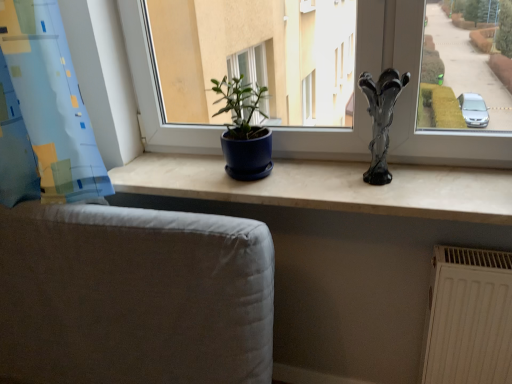
Question: Is point (382, 130) positioned closer to the camera than point (42, 89)?

Choices:
 (A) farther
 (B) closer

Answer: (A)

Question: Is transparent glass vase at right wider or thinner than blue fabric curtain at left?

Choices:
 (A) wide
 (B) thin

Answer: (B)

Question: Which is nearer to the blue fabric curtain at left?

Choices:
 (A) gray fabric armchair at lower left
 (B) white textured radiator at lower right
 (C) matte blue pot at center
 (D) transparent glass vase at right
 (E) matte blue pot at center

Answer: (A)

Question: Estimate the real-world distances between objects in this image. Which object is closer to the matte blue pot at center?

Choices:
 (A) gray fabric armchair at lower left
 (B) white textured radiator at lower right
 (C) blue fabric curtain at left
 (D) matte blue pot at center
 (E) transparent glass vase at right

Answer: (D)